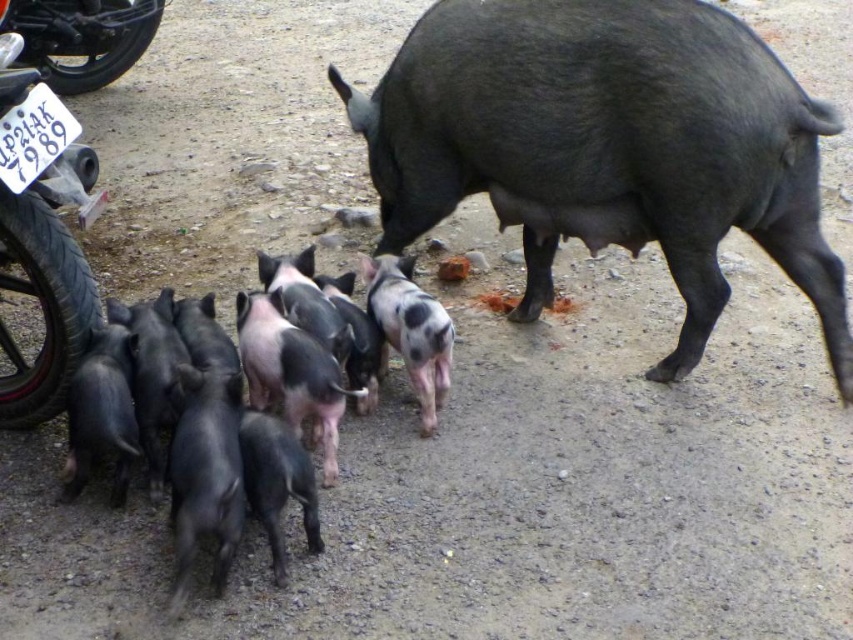
You are a farmer checking on your pigs. You see the black rubber tire at left and the black glossy piglets at center. Which object is positioned higher up in the image?

The black rubber tire at left is above the black glossy piglets at center, so it is positioned higher up in the image.

You are a farmer checking the field and notice the black rubber tire at left and the black glossy piglets at center. Which object is located to the left of the other?

The black rubber tire at left is positioned on the left side of black glossy piglets at center.

Consider the image. You are a farmer checking the piglets in the field. You notice the shiny black piglet at center and the black rubber tire at left. Which object is bigger?

The shiny black piglet at center is larger in size than the black rubber tire at left.